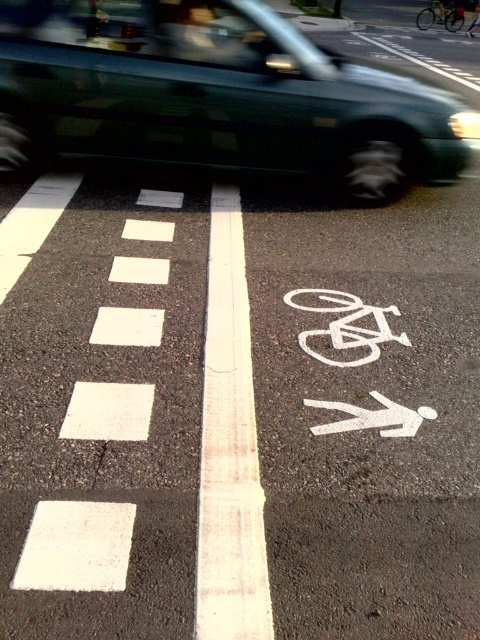
Question: Is white painted bike lane at center to the right of green metallic van at upper center from the viewer's perspective?

Choices:
 (A) yes
 (B) no

Answer: (A)

Question: Can you confirm if white painted bike lane at center is positioned to the left of metallic silver bicycle at center?

Choices:
 (A) no
 (B) yes

Answer: (B)

Question: Which of the following is the farthest from the observer?

Choices:
 (A) (444, 3)
 (B) (165, 128)

Answer: (A)

Question: Which point is closer to the camera?

Choices:
 (A) (456, 16)
 (B) (115, 477)

Answer: (B)

Question: Considering the relative positions of white painted bike lane at center and metallic silver bicycle at center in the image provided, where is white painted bike lane at center located with respect to metallic silver bicycle at center?

Choices:
 (A) above
 (B) below

Answer: (B)

Question: Which of the following is the closest to the observer?

Choices:
 (A) (444, 19)
 (B) (36, 148)
 (C) (180, 593)

Answer: (C)